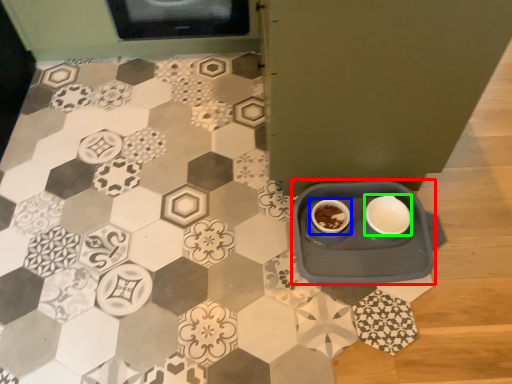
Question: Which object is positioned closest to table (highlighted by a red box)? Select from coffee cup (highlighted by a blue box) and tableware (highlighted by a green box).

Choices:
 (A) coffee cup
 (B) tableware

Answer: (B)